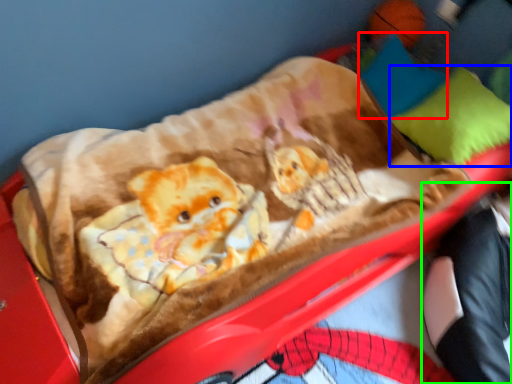
Question: Considering the real-world distances, which object is closest to pillow (highlighted by a red box)? pillow (highlighted by a blue box) or couple (highlighted by a green box).

Choices:
 (A) pillow
 (B) couple

Answer: (A)